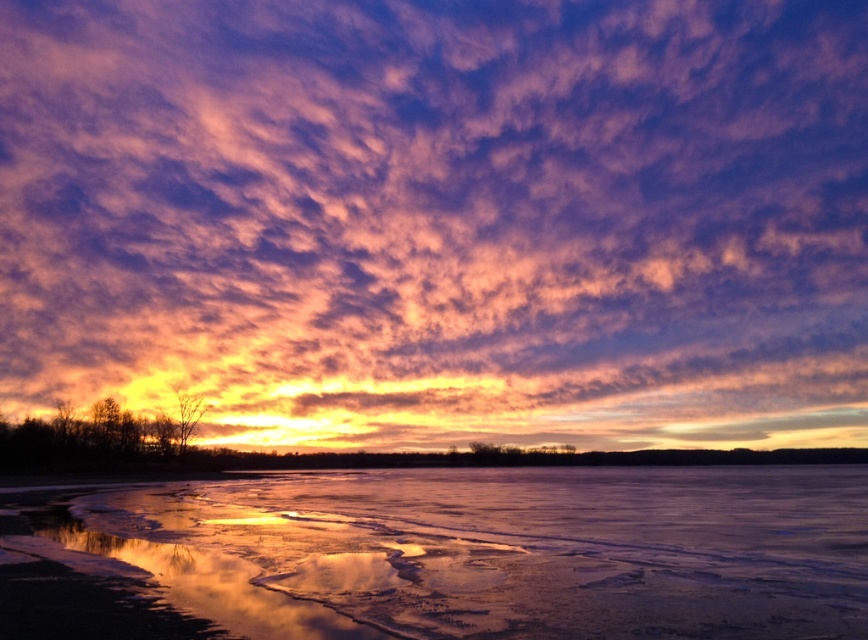
Question: Is purple cotton clouds at upper center closer to camera compared to icy reflective water at lower center?

Choices:
 (A) no
 (B) yes

Answer: (A)

Question: Observing the image, what is the correct spatial positioning of purple cotton clouds at upper center in reference to icy reflective water at lower center?

Choices:
 (A) right
 (B) left

Answer: (B)

Question: In this image, where is purple cotton clouds at upper center located relative to icy reflective water at lower center?

Choices:
 (A) below
 (B) above

Answer: (B)

Question: Among these points, which one is farthest from the camera?

Choices:
 (A) (533, 19)
 (B) (462, 524)

Answer: (A)